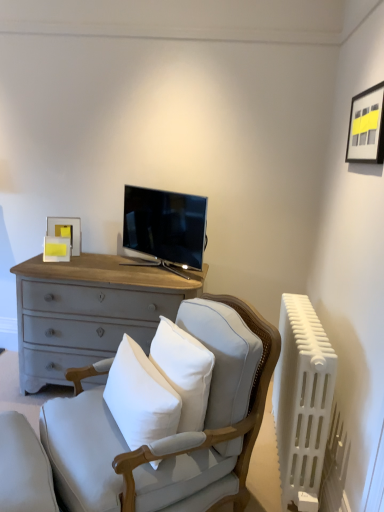
Question: Is matte black tv at center at the left side of matte gray cushion at lower left?

Choices:
 (A) no
 (B) yes

Answer: (A)

Question: From the image's perspective, does matte black tv at center appear lower than matte gray cushion at lower left?

Choices:
 (A) no
 (B) yes

Answer: (A)

Question: Considering the relative sizes of matte black tv at center and matte gray cushion at lower left in the image provided, is matte black tv at center taller than matte gray cushion at lower left?

Choices:
 (A) yes
 (B) no

Answer: (A)

Question: Considering the relative positions of matte black tv at center and matte gray cushion at lower left in the image provided, is matte black tv at center to the right of matte gray cushion at lower left from the viewer's perspective?

Choices:
 (A) no
 (B) yes

Answer: (B)

Question: Is matte black tv at center completely or partially outside of matte gray cushion at lower left?

Choices:
 (A) no
 (B) yes

Answer: (B)

Question: Is point (155, 407) closer or farther from the camera than point (84, 460)?

Choices:
 (A) closer
 (B) farther

Answer: (B)

Question: From the image's perspective, relative to light gray fabric rocking chair at center, is white cotton pillow at center above or below?

Choices:
 (A) below
 (B) above

Answer: (B)

Question: Looking at the image, does white cotton pillow at center seem bigger or smaller compared to light gray fabric rocking chair at center?

Choices:
 (A) big
 (B) small

Answer: (B)

Question: Is white cotton pillow at center in front of or behind light gray fabric rocking chair at center in the image?

Choices:
 (A) front
 (B) behind

Answer: (B)

Question: In terms of height, does light gray fabric rocking chair at center look taller or shorter compared to white cotton pillow at center?

Choices:
 (A) tall
 (B) short

Answer: (A)

Question: Is light gray fabric rocking chair at center inside or outside of white cotton pillow at center?

Choices:
 (A) inside
 (B) outside

Answer: (B)

Question: From a real-world perspective, is light gray fabric rocking chair at center physically located above or below white cotton pillow at center?

Choices:
 (A) below
 (B) above

Answer: (A)

Question: Does point (228, 392) appear closer or farther from the camera than point (145, 379)?

Choices:
 (A) closer
 (B) farther

Answer: (B)

Question: From a real-world perspective, is white cotton pillow at center positioned above or below white plastic radiator at right?

Choices:
 (A) above
 (B) below

Answer: (A)

Question: In the image, is white cotton pillow at center on the left side or the right side of white plastic radiator at right?

Choices:
 (A) right
 (B) left

Answer: (B)